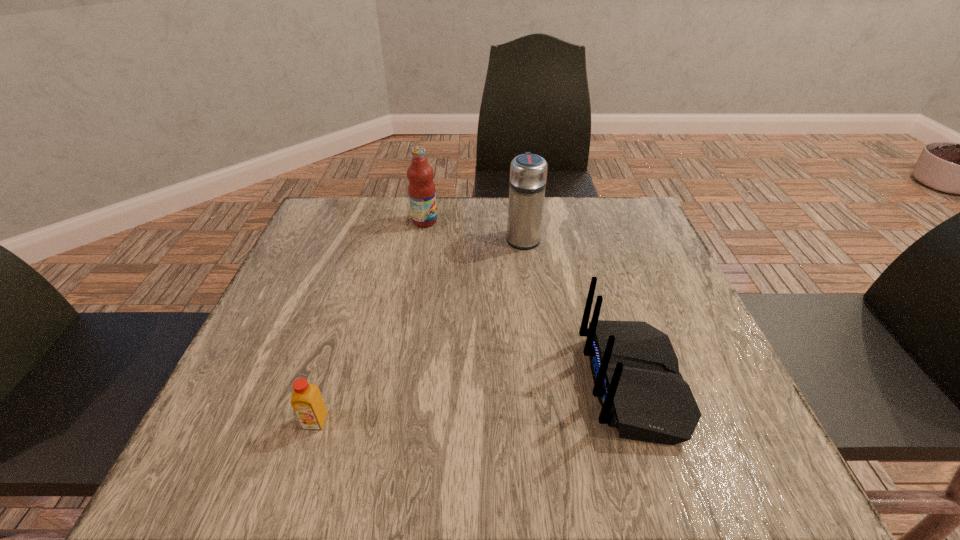
I want to click on free space that satisfies the following two spatial constraints: 1. on the front label of the fruit juice; 2. with a handle on the side of the second object from right to left, so click(x=421, y=238).

Locate an element on the screen. The width and height of the screenshot is (960, 540). free space that satisfies the following two spatial constraints: 1. on the front label of the fruit juice; 2. on the front and back of the orange juice is located at coordinates (391, 421).

Where is `free space that satisfies the following two spatial constraints: 1. on the front label of the second object from left to right; 2. with a handle on the side of the third object from left to right`? This screenshot has width=960, height=540. free space that satisfies the following two spatial constraints: 1. on the front label of the second object from left to right; 2. with a handle on the side of the third object from left to right is located at coordinates (421, 238).

Locate an element on the screen. free spot that satisfies the following two spatial constraints: 1. on the back of the rightmost object; 2. on the front and back of the leftmost object is located at coordinates (645, 421).

The height and width of the screenshot is (540, 960). Identify the location of vacant space that satisfies the following two spatial constraints: 1. on the back of the router; 2. on the front and back of the orange juice. (645, 421).

I want to click on free region that satisfies the following two spatial constraints: 1. on the front label of the fruit juice; 2. with a handle on the side of the thermos bottle, so click(421, 238).

The width and height of the screenshot is (960, 540). Find the location of `vacant region that satisfies the following two spatial constraints: 1. on the front label of the second object from left to right; 2. on the front and back of the leftmost object`. vacant region that satisfies the following two spatial constraints: 1. on the front label of the second object from left to right; 2. on the front and back of the leftmost object is located at coordinates (391, 421).